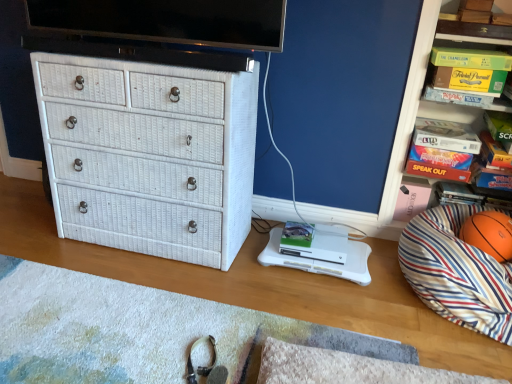
Locate an element on the screen. This screenshot has width=512, height=384. vacant space positioned to the left of striped fabric bean bag at right is located at coordinates (334, 296).